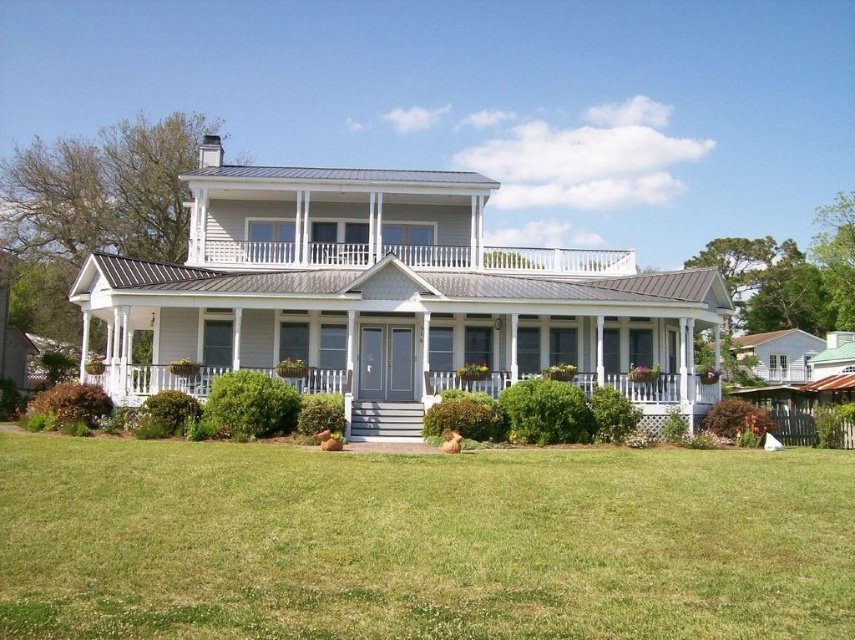
Question: Which object appears farthest from the camera in this image?

Choices:
 (A) white painted wood porch at upper center
 (B) green grass at center

Answer: (A)

Question: Does green grass at center appear on the right side of white painted wood porch at upper center?

Choices:
 (A) no
 (B) yes

Answer: (A)

Question: Among these objects, which one is farthest from the camera?

Choices:
 (A) white painted wood porch at upper center
 (B) green grass at center

Answer: (A)

Question: In this image, where is green grass at center located relative to white painted wood porch at upper center?

Choices:
 (A) right
 (B) left

Answer: (B)

Question: Observing the image, what is the correct spatial positioning of green grass at center in reference to white painted wood porch at upper center?

Choices:
 (A) right
 (B) left

Answer: (B)

Question: Which point appears closest to the camera in this image?

Choices:
 (A) (248, 244)
 (B) (529, 544)

Answer: (B)